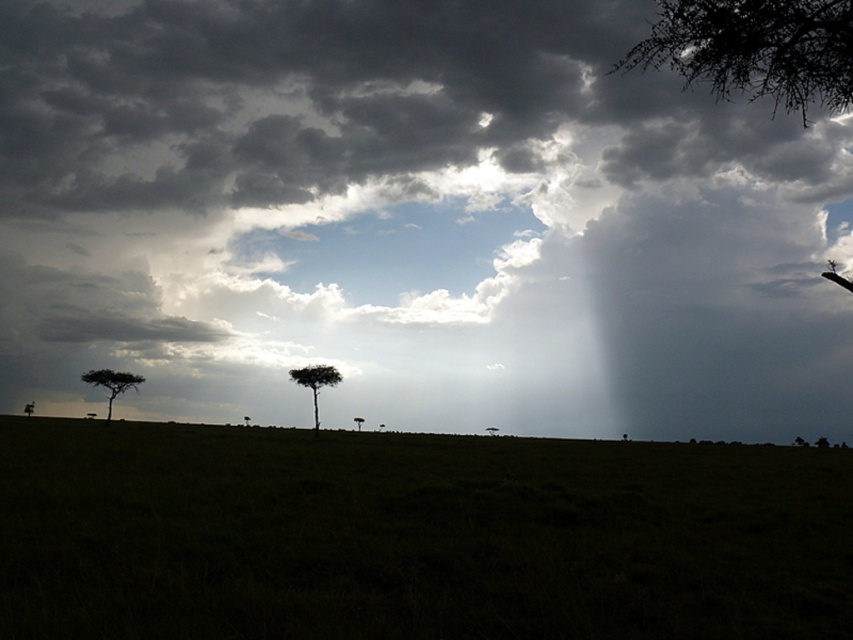
Question: Does dark gray cloud at upper center have a greater width compared to green matte tree at center?

Choices:
 (A) yes
 (B) no

Answer: (A)

Question: Which point appears closest to the camera in this image?

Choices:
 (A) (144, 182)
 (B) (115, 372)

Answer: (A)

Question: Is dark gray cloud at upper center above dark green leafy tree at upper right?

Choices:
 (A) no
 (B) yes

Answer: (A)

Question: Which point is farther to the camera?

Choices:
 (A) (117, 378)
 (B) (294, 371)

Answer: (A)

Question: Among these objects, which one is nearest to the camera?

Choices:
 (A) silhouette leafy tree at lower left
 (B) dark green leafy tree at upper right
 (C) green matte tree at center

Answer: (B)

Question: Is dark gray cloud at upper center thinner than silhouette leafy tree at lower left?

Choices:
 (A) no
 (B) yes

Answer: (A)